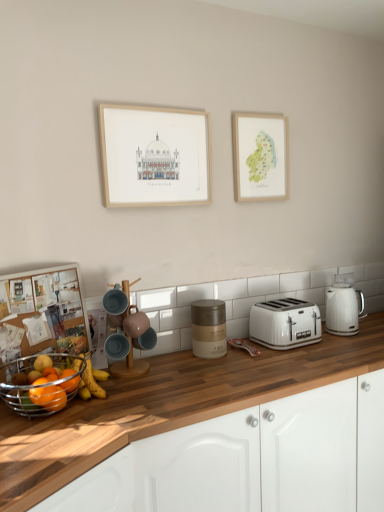
You are a GUI agent. You are given a task and a screenshot of the screen. Output one action in this format:
    pyautogui.click(x=<x>, y=<y>)
    Task: Click on the vacant area that lies to the right of matte gold canister at center, placed as the third appliance when sorted from front to back
    The width and height of the screenshot is (384, 512).
    Given the screenshot: What is the action you would take?
    pyautogui.click(x=248, y=358)